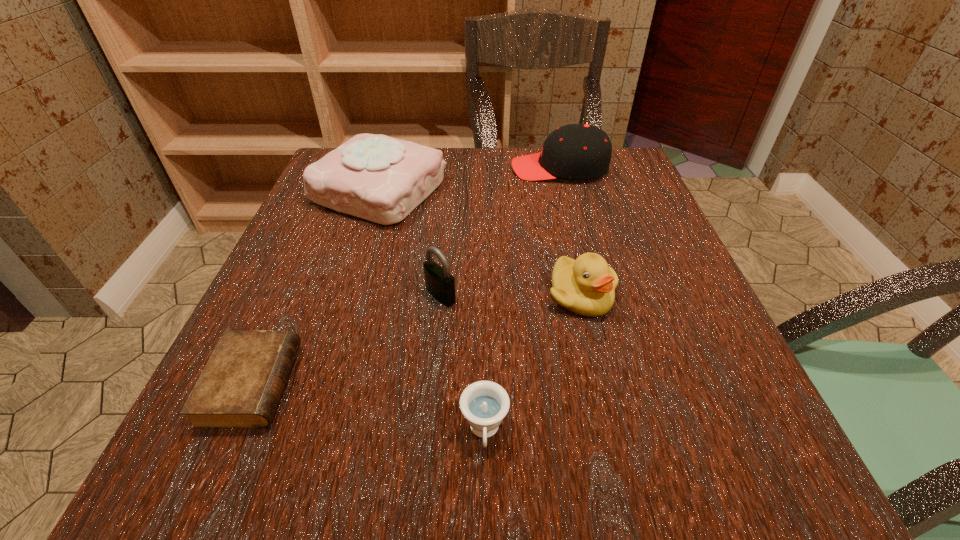
Find the location of `duckling located at the right edge`. duckling located at the right edge is located at coordinates (586, 286).

This screenshot has width=960, height=540. In order to click on object located in the far left corner section of the desktop in this screenshot , I will do `click(378, 178)`.

Identify the location of object that is at the far right corner. Image resolution: width=960 pixels, height=540 pixels. (575, 151).

The image size is (960, 540). In the image, there is a desktop. Find the location of `vacant space at the far edge`. vacant space at the far edge is located at coordinates (502, 176).

Locate an element on the screen. This screenshot has width=960, height=540. free spot at the near edge of the desktop is located at coordinates (373, 491).

Where is `vacant space at the left edge`? Image resolution: width=960 pixels, height=540 pixels. vacant space at the left edge is located at coordinates (337, 259).

I want to click on vacant space at the right edge, so click(737, 415).

Where is `free space at the near right corner`? free space at the near right corner is located at coordinates (679, 452).

Find the location of a particular element. Image resolution: width=960 pixels, height=540 pixels. free area in between the cake and the shortest object is located at coordinates (316, 287).

Locate an element on the screen. The width and height of the screenshot is (960, 540). vacant point located between the padlock and the third object from right to left is located at coordinates (463, 363).